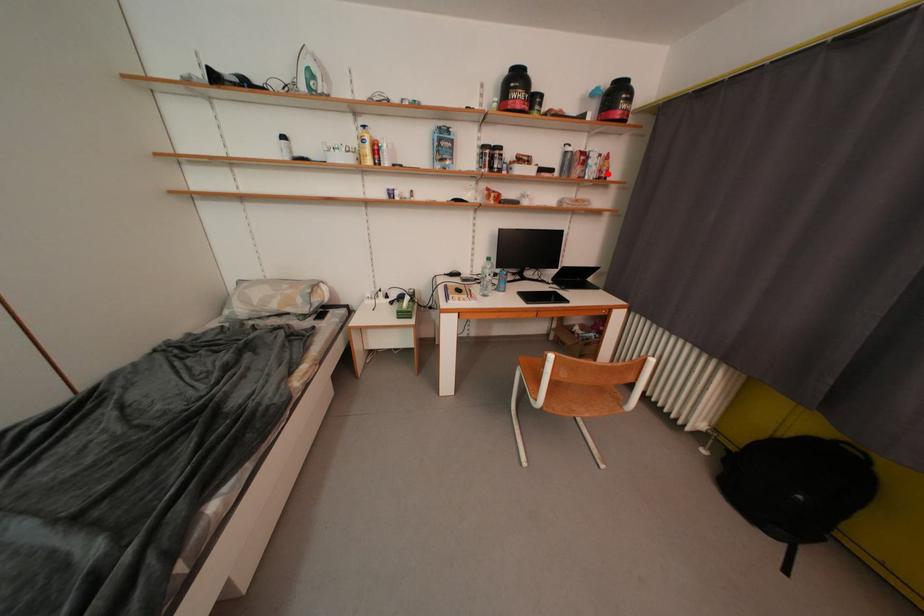
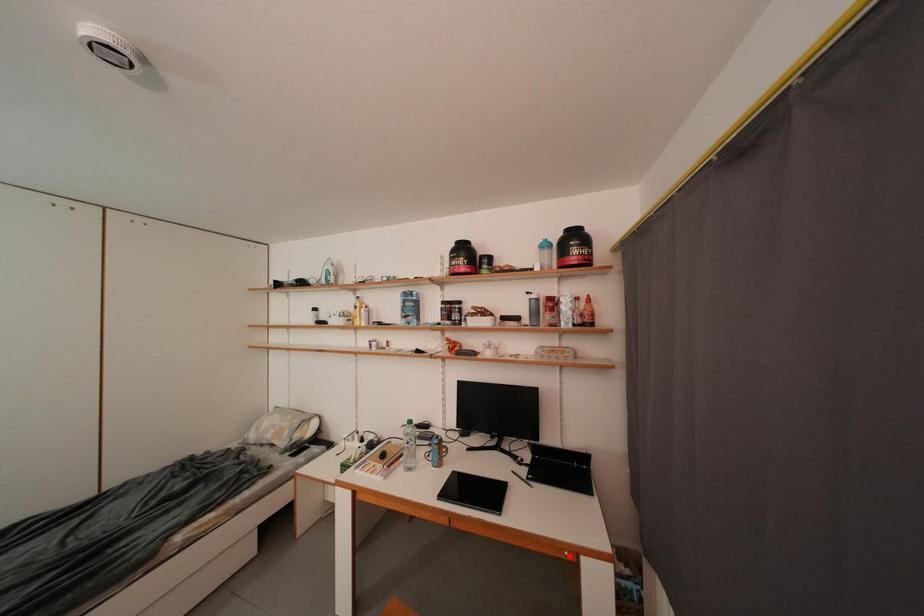
I am providing you with two images of the same scene from different viewpoints. A red point is marked on the first image and another point is marked on the second image. Does the point marked in image1 correspond to the same location as the one in image2?

No